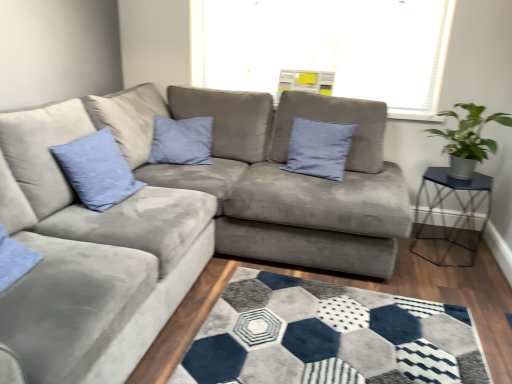
Looking at this image, what is the approximate height of suede gray couch at center?

suede gray couch at center is 34.94 inches in height.

What do you see at coordinates (318, 148) in the screenshot?
I see `blue fabric pillow at center, which is the second pillow from left to right` at bounding box center [318, 148].

How much space does matte blue cushion at upper left, which ranks as the first pillow in left-to-right order, occupy horizontally?

matte blue cushion at upper left, which ranks as the first pillow in left-to-right order, is 29.45 centimeters wide.

Measure the distance between green leafy plant in metallic pot at right and camera.

They are 7.78 feet apart.

You are a GUI agent. You are given a task and a screenshot of the screen. Output one action in this format:
    pyautogui.click(x=<x>, y=<y>)
    Task: Click on the metallic blue glass table at right
    
    Given the screenshot: What is the action you would take?
    pyautogui.click(x=451, y=219)

Where is `suede gray couch at center`? This screenshot has width=512, height=384. suede gray couch at center is located at coordinates (178, 218).

Is metallic blue glass table at right in front of or behind blue fabric pillow at center, the first pillow positioned from the back, in the image?

Clearly, metallic blue glass table at right is in front of blue fabric pillow at center, the first pillow positioned from the back.

From the image's perspective, between metallic blue glass table at right and blue fabric pillow at center, the 2th pillow in the front-to-back sequence, which one is located above?

blue fabric pillow at center, the 2th pillow in the front-to-back sequence, appears higher in the image.

Is metallic blue glass table at right not close to blue fabric pillow at center, the first pillow positioned from the right?

No.

Based on their sizes in the image, would you say metallic blue glass table at right is bigger or smaller than blue fabric pillow at center, the first pillow positioned from the right?

Clearly, metallic blue glass table at right is larger in size than blue fabric pillow at center, the first pillow positioned from the right.

Is point (108, 154) closer or farther from the camera than point (470, 151)?

Point (108, 154) is closer to the camera than point (470, 151).

Can you confirm if matte blue cushion at upper left, the 1th pillow positioned from the front, is wider than green leafy plant in metallic pot at right?

In fact, matte blue cushion at upper left, the 1th pillow positioned from the front, might be narrower than green leafy plant in metallic pot at right.

Which is behind, matte blue cushion at upper left, acting as the 2th pillow starting from the right, or green leafy plant in metallic pot at right?

green leafy plant in metallic pot at right is further from the camera.

In the scene shown: From the image's perspective, is matte blue cushion at upper left, the 1th pillow positioned from the front, above green leafy plant in metallic pot at right?

No, from the image's perspective, matte blue cushion at upper left, the 1th pillow positioned from the front, is not over green leafy plant in metallic pot at right.

Where is `houseplant below the blue fabric pillow at center, which is the second pillow from left to right (from the image's perspective)`? Image resolution: width=512 pixels, height=384 pixels. houseplant below the blue fabric pillow at center, which is the second pillow from left to right (from the image's perspective) is located at coordinates (468, 139).

Is green leafy plant in metallic pot at right oriented away from blue fabric pillow at center, which is the second pillow from left to right?

green leafy plant in metallic pot at right does not have its back to blue fabric pillow at center, which is the second pillow from left to right.

Could you measure the distance between green leafy plant in metallic pot at right and blue fabric pillow at center, the first pillow positioned from the back?

The distance of green leafy plant in metallic pot at right from blue fabric pillow at center, the first pillow positioned from the back, is 27.56 inches.

Is green leafy plant in metallic pot at right with blue fabric pillow at center, which is the second pillow from left to right?

They are not placed beside each other.

Which is more to the right, blue fabric pillow at center, which is the second pillow from left to right, or matte blue cushion at upper left, the second pillow viewed from the back?

blue fabric pillow at center, which is the second pillow from left to right.

Is blue fabric pillow at center, which is the second pillow from left to right, positioned with its back to matte blue cushion at upper left, which ranks as the first pillow in left-to-right order?

No, blue fabric pillow at center, which is the second pillow from left to right,'s orientation is not away from matte blue cushion at upper left, which ranks as the first pillow in left-to-right order.

From the image's perspective, between blue fabric pillow at center, the 2th pillow in the front-to-back sequence, and matte blue cushion at upper left, which ranks as the first pillow in left-to-right order, who is located below?

matte blue cushion at upper left, which ranks as the first pillow in left-to-right order, from the image's perspective.

Where is `pillow that appears below the blue fabric pillow at center, which is the second pillow from left to right (from the image's perspective)`? pillow that appears below the blue fabric pillow at center, which is the second pillow from left to right (from the image's perspective) is located at coordinates (96, 170).

From the image's perspective, which is below, green leafy plant in metallic pot at right or matte blue cushion at upper left, acting as the 2th pillow starting from the right?

matte blue cushion at upper left, acting as the 2th pillow starting from the right, appears lower in the image.

Can you tell me how much green leafy plant in metallic pot at right and matte blue cushion at upper left, the 1th pillow positioned from the front, differ in facing direction?

88.4 degrees.

Is green leafy plant in metallic pot at right at the left side of matte blue cushion at upper left, which ranks as the first pillow in left-to-right order?

No.

Relative to suede gray couch at center, is green leafy plant in metallic pot at right in front or behind?

green leafy plant in metallic pot at right is behind suede gray couch at center.

Locate an element on the screen. The height and width of the screenshot is (384, 512). studio couch below the green leafy plant in metallic pot at right (from the image's perspective) is located at coordinates (178, 218).

From a real-world perspective, who is located lower, green leafy plant in metallic pot at right or suede gray couch at center?

suede gray couch at center, from a real-world perspective.

Visually, is green leafy plant in metallic pot at right positioned to the left or to the right of suede gray couch at center?

From the image, it's evident that green leafy plant in metallic pot at right is to the right of suede gray couch at center.

Between blue fabric pillow at center, the first pillow positioned from the back, and suede gray couch at center, which one has less height?

blue fabric pillow at center, the first pillow positioned from the back, is shorter.

Is blue fabric pillow at center, the first pillow positioned from the right, smaller than suede gray couch at center?

Correct, blue fabric pillow at center, the first pillow positioned from the right, occupies less space than suede gray couch at center.

At what (x,y) coordinates should I click in order to perform the action: click on studio couch below the blue fabric pillow at center, the 2th pillow in the front-to-back sequence (from the image's perspective). Please return your answer as a coordinate pair (x, y). Image resolution: width=512 pixels, height=384 pixels. Looking at the image, I should click on (178, 218).

Is blue fabric pillow at center, which is the second pillow from left to right, aimed at suede gray couch at center?

Yes, blue fabric pillow at center, which is the second pillow from left to right, is facing suede gray couch at center.

Locate an element on the screen. The width and height of the screenshot is (512, 384). table in front of the blue fabric pillow at center, the first pillow positioned from the back is located at coordinates (451, 219).

Which pillow is the 2nd one when counting from the left side of the green leafy plant in metallic pot at right? Please provide its 2D coordinates.

[(96, 170)]

Considering their positions, is matte blue cushion at upper left, the 1th pillow positioned from the front, positioned further to metallic blue glass table at right than blue fabric pillow at center, which is the second pillow from left to right?

matte blue cushion at upper left, the 1th pillow positioned from the front, lies further to metallic blue glass table at right than the other object.

Considering their positions, is green leafy plant in metallic pot at right positioned further to matte blue cushion at upper left, which ranks as the first pillow in left-to-right order, than blue fabric pillow at center, the 2th pillow in the front-to-back sequence?

Among the two, green leafy plant in metallic pot at right is located further to matte blue cushion at upper left, which ranks as the first pillow in left-to-right order.

Which object lies further to the anchor point suede gray couch at center, green leafy plant in metallic pot at right or matte blue cushion at upper left, which ranks as the first pillow in left-to-right order?

The object further to suede gray couch at center is green leafy plant in metallic pot at right.

Looking at the image, which one is located closer to blue fabric pillow at center, the first pillow positioned from the back, suede gray couch at center or metallic blue glass table at right?

The object closer to blue fabric pillow at center, the first pillow positioned from the back, is suede gray couch at center.

Considering their positions, is metallic blue glass table at right positioned closer to matte blue cushion at upper left, the 1th pillow positioned from the front, than green leafy plant in metallic pot at right?

green leafy plant in metallic pot at right is closer to matte blue cushion at upper left, the 1th pillow positioned from the front.

Looking at the image, which one is located further to blue fabric pillow at center, the 2th pillow in the front-to-back sequence, metallic blue glass table at right or green leafy plant in metallic pot at right?

Among the two, metallic blue glass table at right is located further to blue fabric pillow at center, the 2th pillow in the front-to-back sequence.

When comparing their distances from green leafy plant in metallic pot at right, does suede gray couch at center or metallic blue glass table at right seem further?

suede gray couch at center is further to green leafy plant in metallic pot at right.

When comparing their distances from matte blue cushion at upper left, the 1th pillow positioned from the front, does suede gray couch at center or blue fabric pillow at center, the first pillow positioned from the right, seem closer?

suede gray couch at center.

You are a GUI agent. You are given a task and a screenshot of the screen. Output one action in this format:
    pyautogui.click(x=<x>, y=<y>)
    Task: Click on the studio couch between matte blue cushion at upper left, the second pillow viewed from the back, and metallic blue glass table at right
    
    Given the screenshot: What is the action you would take?
    pyautogui.click(x=178, y=218)

Identify the location of table between suede gray couch at center and blue fabric pillow at center, the first pillow positioned from the back, along the z-axis. The height and width of the screenshot is (384, 512). (451, 219).

Where is `houseplant between suede gray couch at center and metallic blue glass table at right along the z-axis`? This screenshot has width=512, height=384. houseplant between suede gray couch at center and metallic blue glass table at right along the z-axis is located at coordinates (468, 139).

I want to click on houseplant between suede gray couch at center and blue fabric pillow at center, the first pillow positioned from the back, along the z-axis, so click(x=468, y=139).